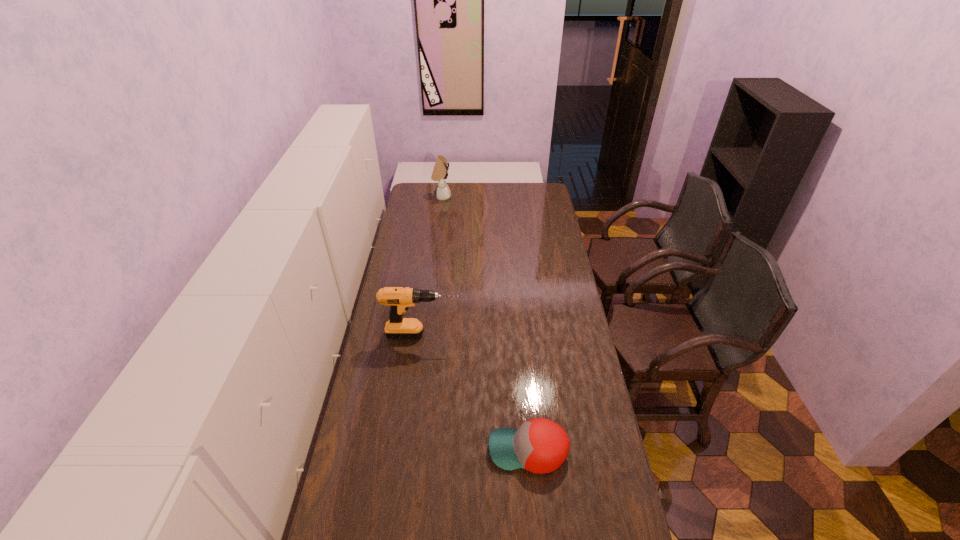
The width and height of the screenshot is (960, 540). What are the coordinates of `doll` in the screenshot? It's located at (440, 173).

At what (x,y) coordinates should I click in order to perform the action: click on the second farthest object. Please return your answer as a coordinate pair (x, y). Looking at the image, I should click on (399, 299).

You are a GUI agent. You are given a task and a screenshot of the screen. Output one action in this format:
    pyautogui.click(x=<x>, y=<y>)
    Task: Click on the baseball cap
    
    Given the screenshot: What is the action you would take?
    pyautogui.click(x=540, y=445)

The height and width of the screenshot is (540, 960). Find the location of `the rightmost object`. the rightmost object is located at coordinates (540, 445).

Find the location of a particular element. This screenshot has height=540, width=960. vacant region located 0.070m at the front face of the farthest object is located at coordinates (463, 197).

Identify the location of vacant space located at the tip of the second farthest object. tap(478, 334).

Locate an element on the screen. vacant point located 0.400m at the brim of the rightmost object is located at coordinates (365, 451).

The width and height of the screenshot is (960, 540). I want to click on vacant space located at the brim of the rightmost object, so click(469, 451).

The image size is (960, 540). Identify the location of blank space located at the brim of the rightmost object. (472, 451).

In order to click on object that is at the far edge in this screenshot , I will do `click(440, 173)`.